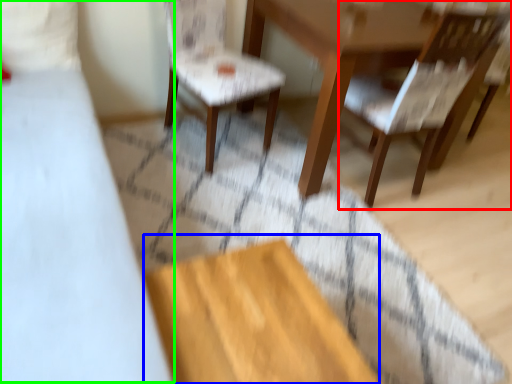
Question: Estimate the real-world distances between objects in this image. Which object is closer to chair (highlighted by a red box), plywood (highlighted by a blue box) or bed (highlighted by a green box)?

Choices:
 (A) plywood
 (B) bed

Answer: (A)